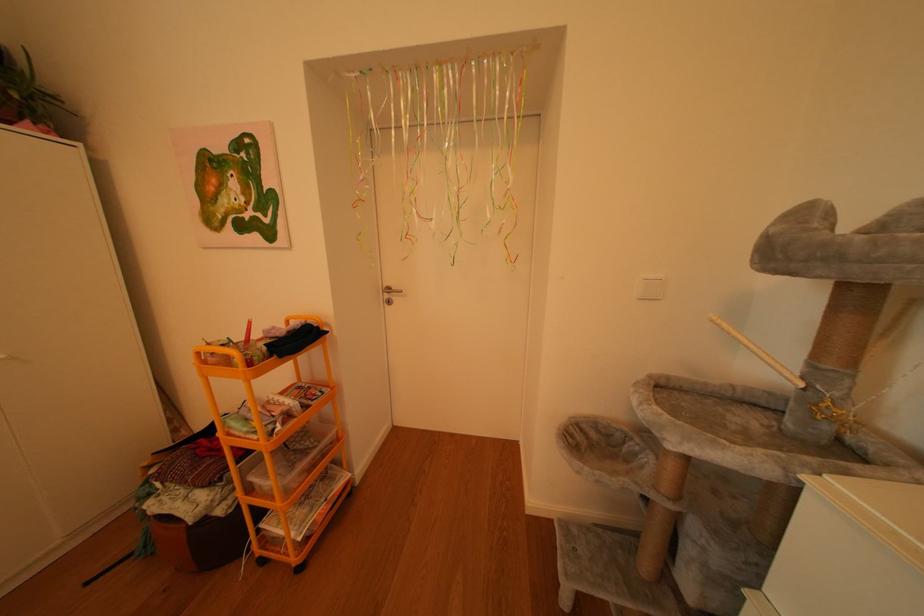
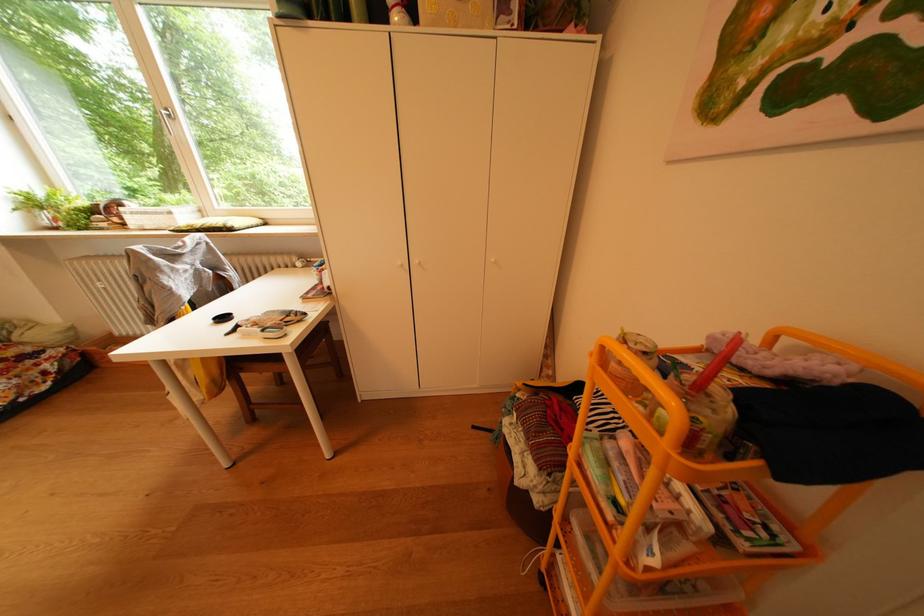
Based on the continuous images, in which direction is the camera rotating?

The camera rotated toward left-down.